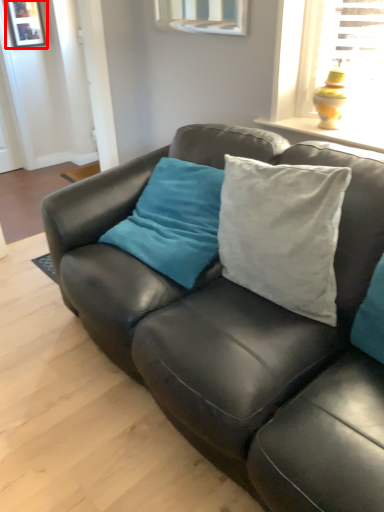
Question: In this image, where is picture frame (annotated by the red box) located relative to studio couch?

Choices:
 (A) right
 (B) left

Answer: (B)